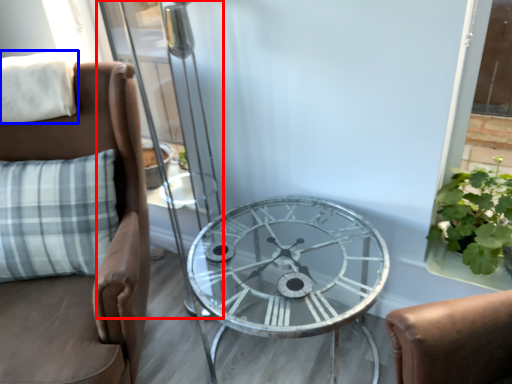
Question: Among these objects, which one is farthest to the camera, screen door (highlighted by a red box) or pillow (highlighted by a blue box)?

Choices:
 (A) screen door
 (B) pillow

Answer: (B)